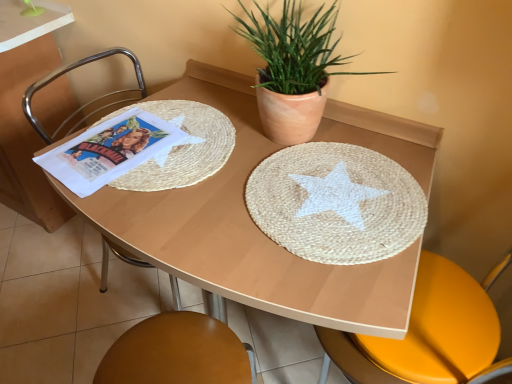
At what (x,y) coordinates should I click in order to perform the action: click on free space above white paper comic book at left (from a real-world perspective). Please return your answer as a coordinate pair (x, y). Looking at the image, I should click on (115, 146).